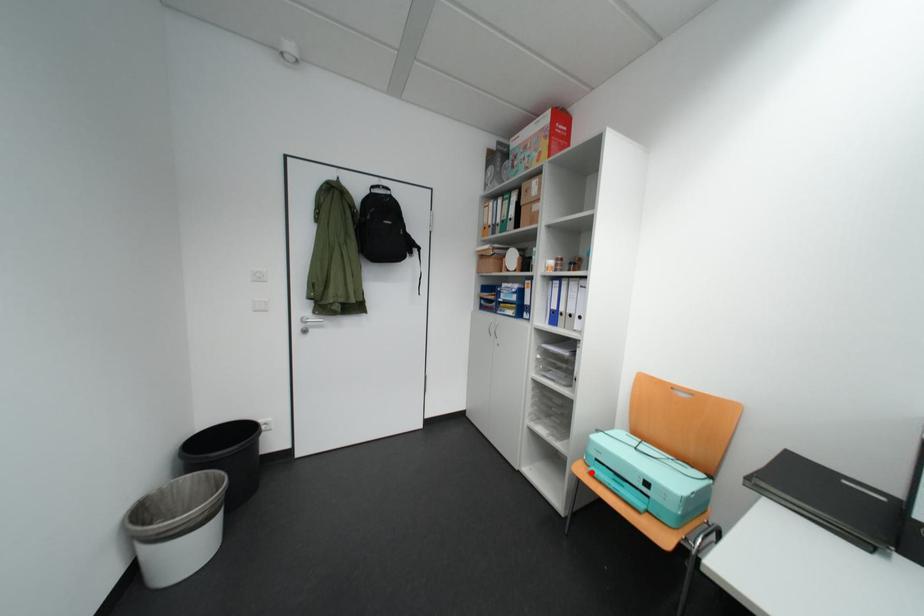
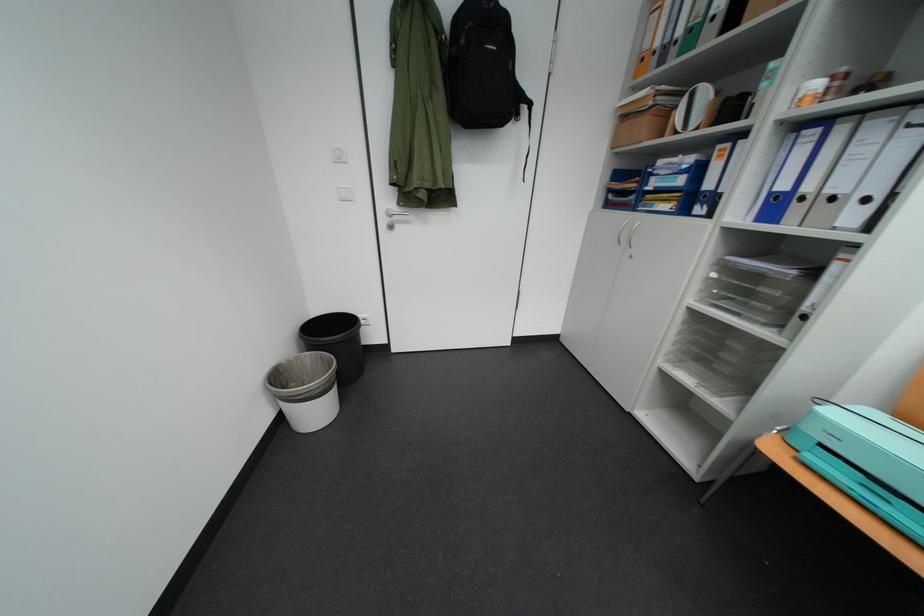
Find the pixel in the second image that matches the highlighted location in the first image.

(784, 451)